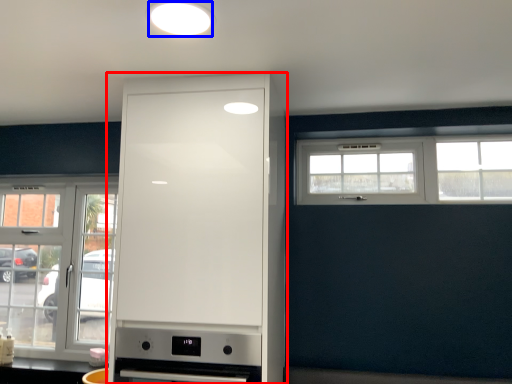
Question: Which point is further to the camera, cabinetry (highlighted by a red box) or lighting (highlighted by a blue box)?

Choices:
 (A) cabinetry
 (B) lighting

Answer: (A)